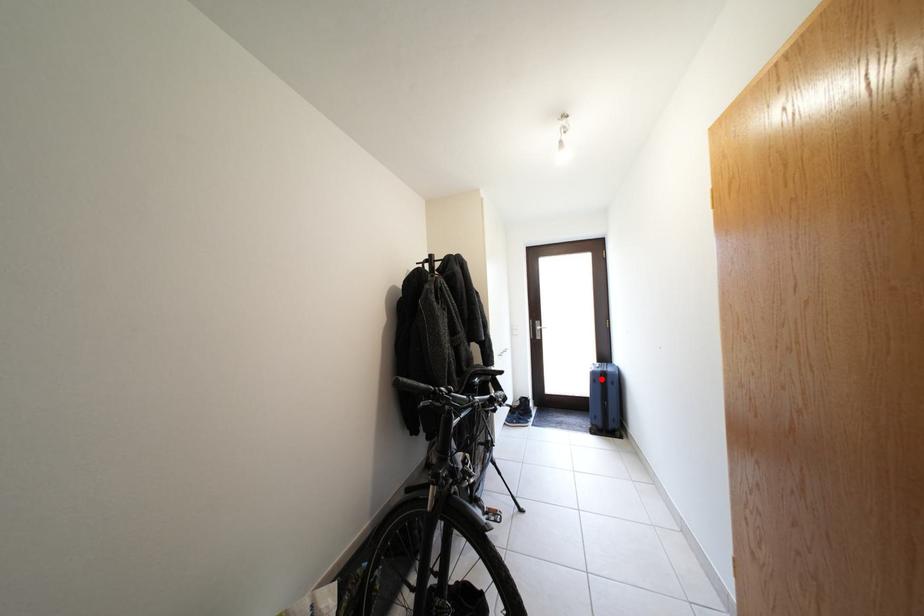
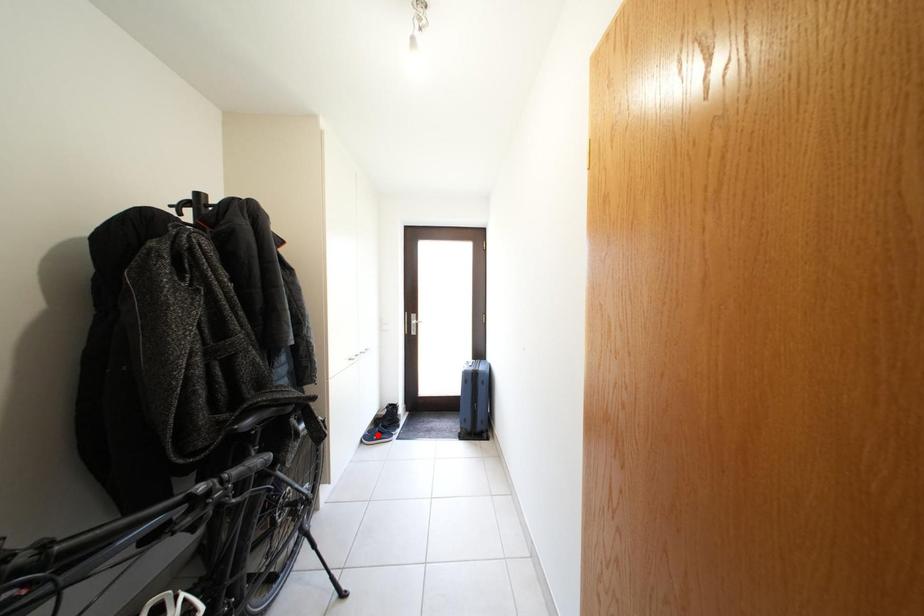
I am providing you with two images of the same scene from different viewpoints. A red point is marked on the first image and another point is marked on the second image. Do the highlighted points in image1 and image2 indicate the same real-world spot?

No